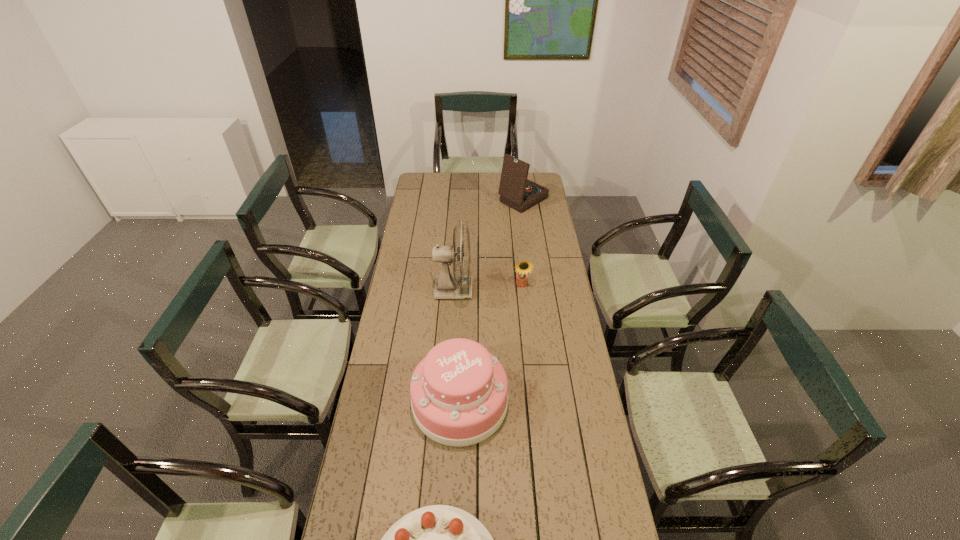
The width and height of the screenshot is (960, 540). I want to click on free area in between the fan and the farthest object, so click(489, 245).

Image resolution: width=960 pixels, height=540 pixels. Identify the location of empty space that is in between the second tallest object and the sunflower. (522, 242).

Locate an element on the screen. The image size is (960, 540). vacant space in between the fan and the sunflower is located at coordinates (488, 288).

Where is `vacant area that lies between the third shortest object and the farthest object`? vacant area that lies between the third shortest object and the farthest object is located at coordinates (492, 301).

Locate an element on the screen. The width and height of the screenshot is (960, 540). free point between the fourth shortest object and the taller birthday cake is located at coordinates (492, 301).

Find the location of a particular element. The width and height of the screenshot is (960, 540). the closest object to the sunflower is located at coordinates (446, 286).

Locate which object ranks second in proximity to the nearest object. Please provide its 2D coordinates. Your answer should be formatted as a tuple, i.e. [(x, y)], where the tuple contains the x and y coordinates of a point satisfying the conditions above.

[(446, 286)]

In order to click on free region that satisfies the following two spatial constraints: 1. on the face of the sunflower; 2. on the front-facing side of the tallest object in this screenshot , I will do `click(522, 290)`.

Find the location of a particular element. free point that satisfies the following two spatial constraints: 1. on the face of the sunflower; 2. on the front-facing side of the tallest object is located at coordinates (522, 290).

The height and width of the screenshot is (540, 960). Find the location of `vacant space that satisfies the following two spatial constraints: 1. on the front-facing side of the tallest object; 2. on the back side of the third tallest object`. vacant space that satisfies the following two spatial constraints: 1. on the front-facing side of the tallest object; 2. on the back side of the third tallest object is located at coordinates (446, 402).